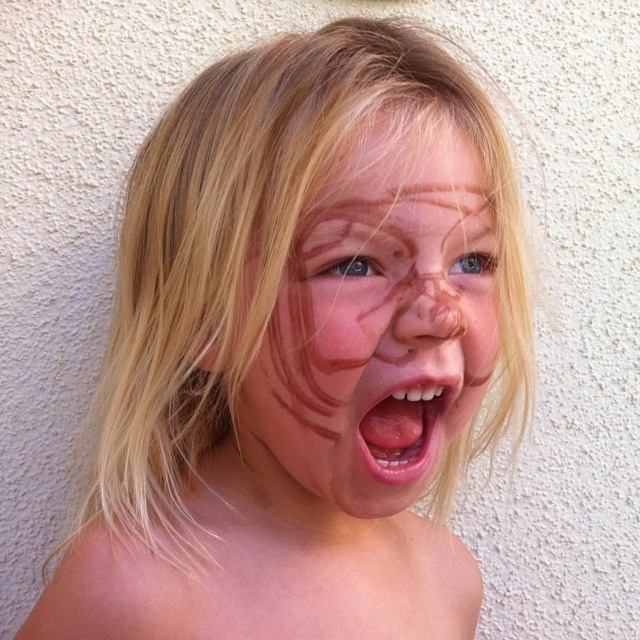
Does pink glossy lips at center appear over blue matte eye at center?

No, pink glossy lips at center is not above blue matte eye at center.

Who is taller, pink glossy lips at center or blue matte eye at center?

pink glossy lips at center is taller.

This screenshot has width=640, height=640. What do you see at coordinates (404, 429) in the screenshot? I see `pink glossy lips at center` at bounding box center [404, 429].

Find the location of `pink glossy lips at center`. pink glossy lips at center is located at coordinates (404, 429).

Does chocolate matte face at center appear over blue matte eye at center?

No.

Describe the element at coordinates (376, 326) in the screenshot. I see `chocolate matte face at center` at that location.

What are the coordinates of `chocolate matte face at center` in the screenshot? It's located at (376, 326).

Is chocolate matte face at center wider than smooth blonde hair at upper center?

Yes.

Does chocolate matte face at center have a larger size compared to smooth blonde hair at upper center?

Correct, chocolate matte face at center is larger in size than smooth blonde hair at upper center.

At what (x,y) coordinates should I click in order to perform the action: click on chocolate matte face at center. Please return your answer as a coordinate pair (x, y). Looking at the image, I should click on (376, 326).

The height and width of the screenshot is (640, 640). Find the location of `chocolate matte face at center`. chocolate matte face at center is located at coordinates (376, 326).